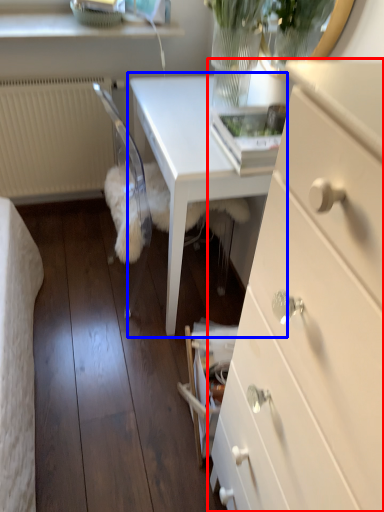
Question: Among these objects, which one is farthest to the camera, chest of drawers (highlighted by a red box) or table (highlighted by a blue box)?

Choices:
 (A) chest of drawers
 (B) table

Answer: (B)